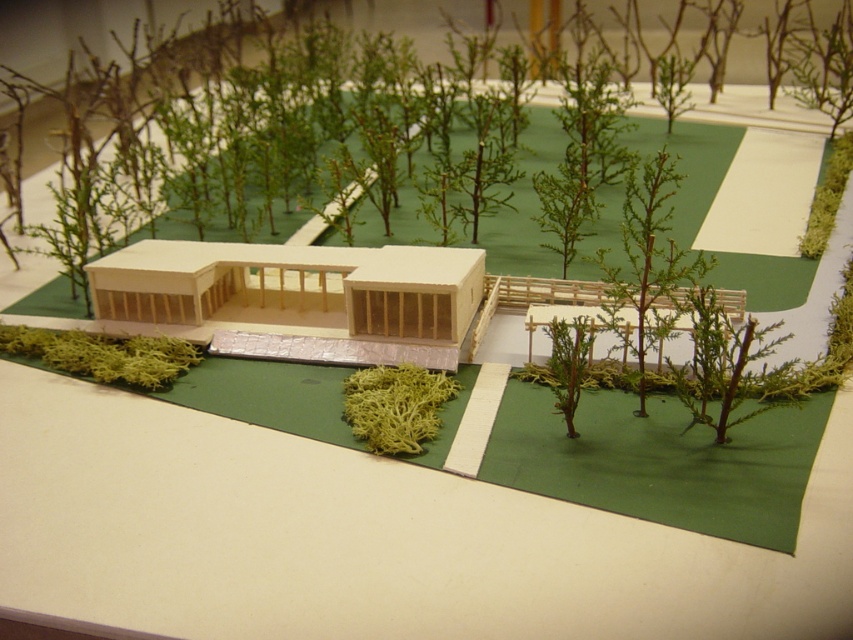
You are examining a miniature model of a modern house surrounded by landscaping. You notice the green moss at lower left. Can you determine its exact coordinates within the image?

The green moss at lower left is located at point (103,355).

You are standing in front of a miniature model of a modern architectural design. You notice a specific point at coordinates point (637, 326). If your hand is 36 inches away from the model, can you reach that point without moving closer?

The distance of point (637, 326) from camera is 36.66 inches. Since your hand is 36 inches away from the model, you cannot reach the point as it is slightly farther than your current reach.